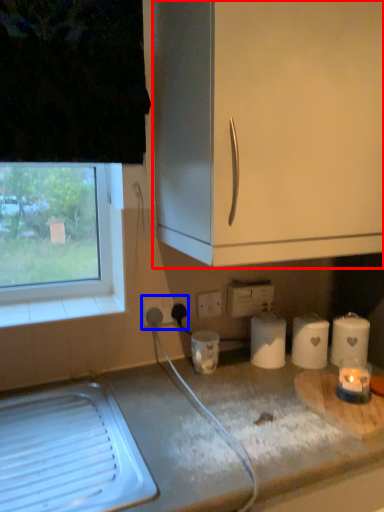
Question: Which of the following is the farthest to the observer, cabinetry (highlighted by a red box) or electric outlet (highlighted by a blue box)?

Choices:
 (A) cabinetry
 (B) electric outlet

Answer: (B)